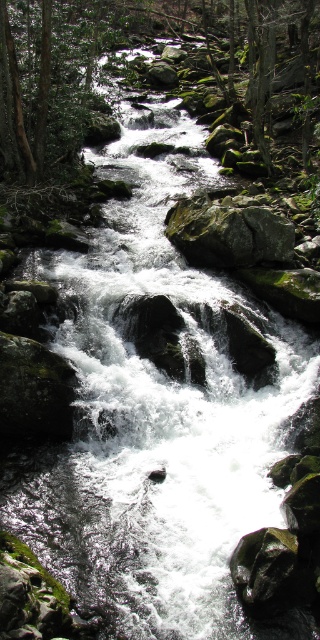
Consider the image. You are standing at the edge of the stream and notice a specific point marked at coordinates point (140, 44). What object is located at that point?

The green mossy rocks at center is located at point (140, 44).